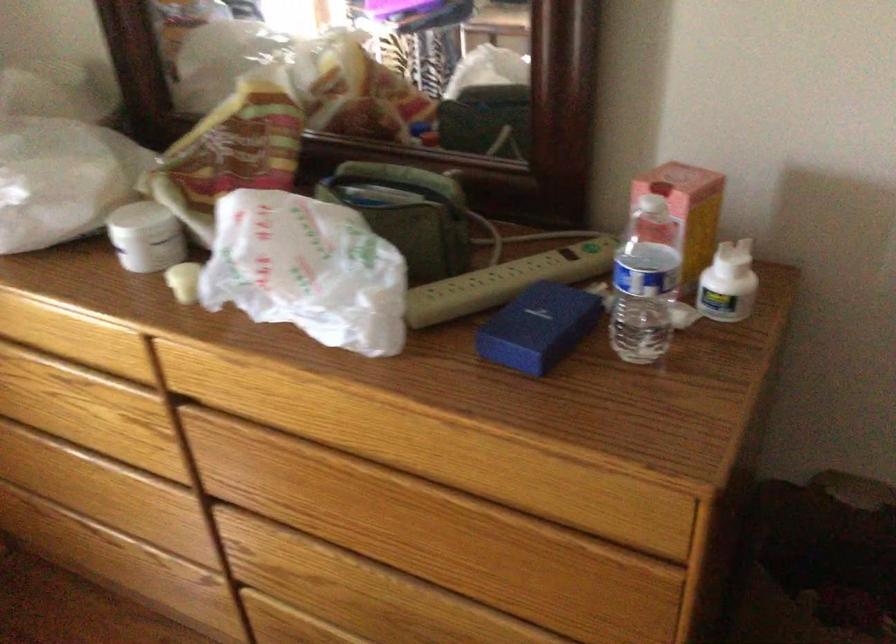
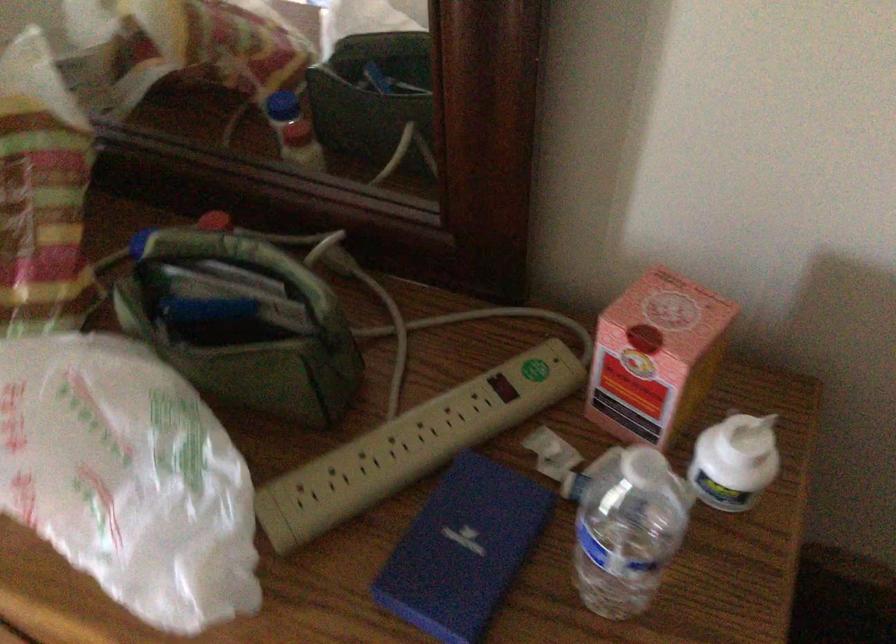
Where in the second image is the point corresponding to [667,199] from the first image?

(656, 357)